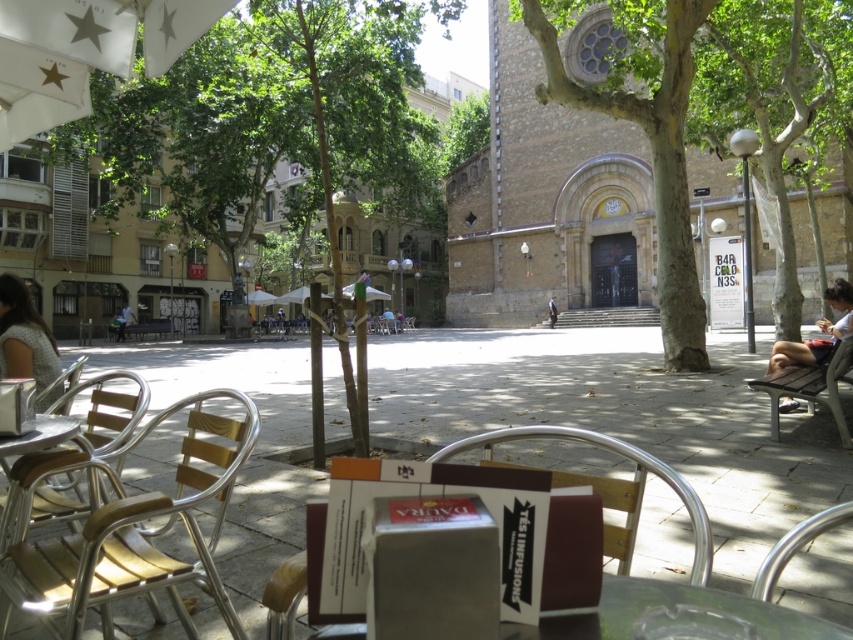
Question: Which object is farther from the camera taking this photo?

Choices:
 (A) green textured tree at center
 (B) metallic silver chair at lower right
 (C) light brown wooden chair at center
 (D) green leafy tree at center

Answer: (C)

Question: Considering the relative positions of green textured tree at center and gray fabric dress at lower left in the image provided, where is green textured tree at center located with respect to gray fabric dress at lower left?

Choices:
 (A) above
 (B) below

Answer: (A)

Question: Which of the following is the closest to the observer?

Choices:
 (A) green leafy tree at right
 (B) light blue denim shorts at right
 (C) gray fabric dress at lower left

Answer: (C)

Question: Can you confirm if metallic silver chair at lower right is bigger than light brown wooden chair at center?

Choices:
 (A) yes
 (B) no

Answer: (B)

Question: Which point is closer to the camera taking this photo?

Choices:
 (A) (711, 100)
 (B) (838, 362)
 (C) (653, 134)

Answer: (B)

Question: Observing the image, what is the correct spatial positioning of wooden slats at left in reference to metallic silver table at lower left?

Choices:
 (A) right
 (B) left

Answer: (A)